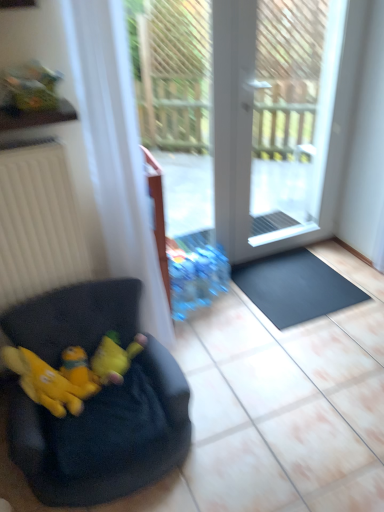
Find the location of a particular element. Image resolution: width=384 pixels, height=512 pixels. vacant space in front of black rubber doormat at lower right is located at coordinates (310, 353).